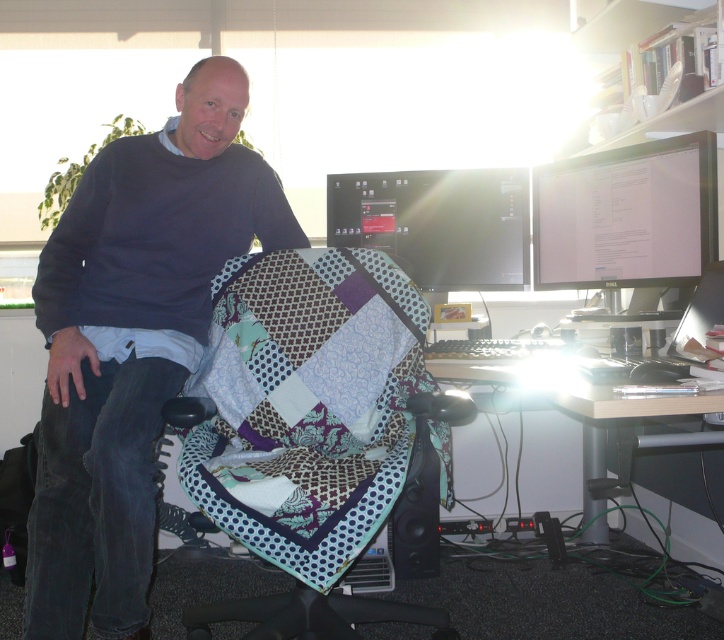
Which is more to the right, patchwork fabric swivel chair at center or wooden desk at lower right?

From the viewer's perspective, wooden desk at lower right appears more on the right side.

Is patchwork fabric swivel chair at center smaller than wooden desk at lower right?

Actually, patchwork fabric swivel chair at center might be larger than wooden desk at lower right.

Which is in front, point (210, 621) or point (571, 413)?

Point (210, 621) is in front.

This screenshot has width=724, height=640. Identify the location of patchwork fabric swivel chair at center. (307, 428).

Is point (694, 138) farther from viewer compared to point (340, 209)?

No, (694, 138) is in front of (340, 209).

Does matte black monitor at upper right have a greater height compared to matte black monitor at center?

Correct, matte black monitor at upper right is much taller as matte black monitor at center.

Does point (584, 227) lie behind point (425, 227)?

No, it is not.

The image size is (724, 640). What are the coordinates of `matte black monitor at upper right` in the screenshot? It's located at (626, 216).

From the picture: Measure the distance between point (113, 145) and camera.

Point (113, 145) and camera are 1.92 meters apart.

Is dark blue sweater at center above matte black monitor at center?

No, dark blue sweater at center is not above matte black monitor at center.

At what (x,y) coordinates should I click in order to perform the action: click on dark blue sweater at center. Please return your answer as a coordinate pair (x, y). Looking at the image, I should click on (132, 340).